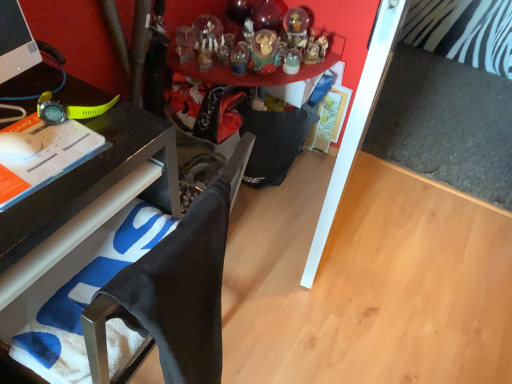
Question: Considering the relative positions of matte black watch at left and translucent glass snow globe at upper center, the second toy when ordered from bottom to top, in the image provided, is matte black watch at left to the left or to the right of translucent glass snow globe at upper center, the second toy when ordered from bottom to top,?

Choices:
 (A) right
 (B) left

Answer: (B)

Question: From the image's perspective, is matte black watch at left above or below translucent glass snow globe at upper center, the 2th toy viewed from the top?

Choices:
 (A) above
 (B) below

Answer: (B)

Question: Estimate the real-world distances between objects in this image. Which object is farther from the translucent glass snow globe at upper center, the second toy when ordered from bottom to top?

Choices:
 (A) matte black watch at left
 (B) black glossy desk at left
 (C) black fabric computer chair at lower left
 (D) translucent glass ornament at upper center, the 3th toy from the bottom
 (E) translucent glass ornament at upper center, which appears as the first toy when ordered from the bottom

Answer: (C)

Question: Which object is the closest to the translucent glass ornament at upper center, the 3th toy from the bottom?

Choices:
 (A) translucent glass snow globe at upper center, the second toy when ordered from bottom to top
 (B) black glossy desk at left
 (C) matte black watch at left
 (D) translucent glass ornament at upper center, the third toy positioned from the top
 (E) black fabric computer chair at lower left

Answer: (A)